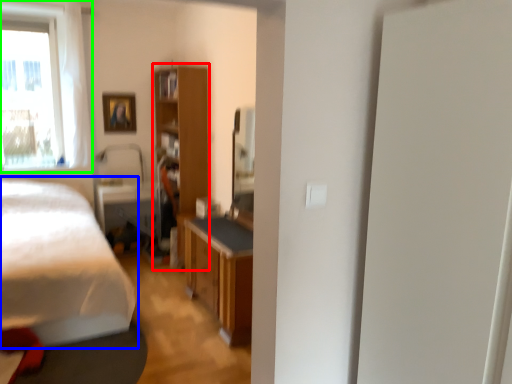
Question: Based on their relative distances, which object is nearer to cabinetry (highlighted by a red box)? Choose from bed (highlighted by a blue box) and window (highlighted by a green box).

Choices:
 (A) bed
 (B) window

Answer: (A)